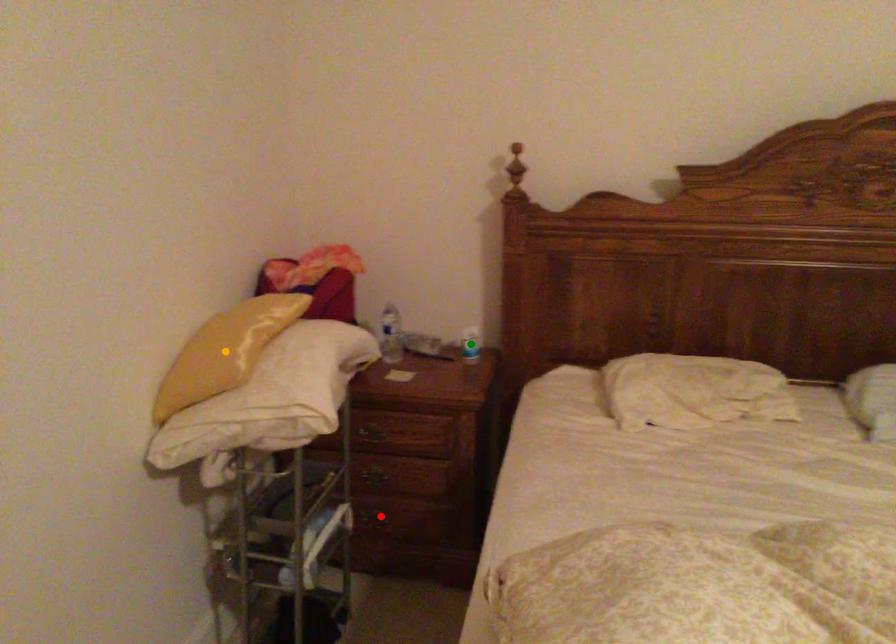
Order these from nearest to farthest:
red point
orange point
green point

orange point
red point
green point